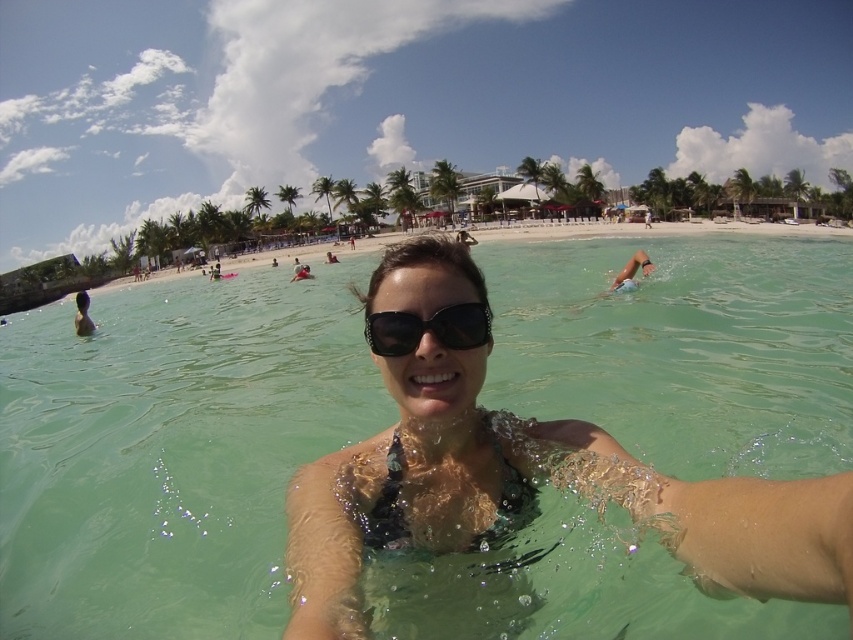
Which is behind, point (44, 598) or point (428, 323)?

The point (44, 598) is more distant.

This screenshot has width=853, height=640. Identify the location of clear water at center. (171, 451).